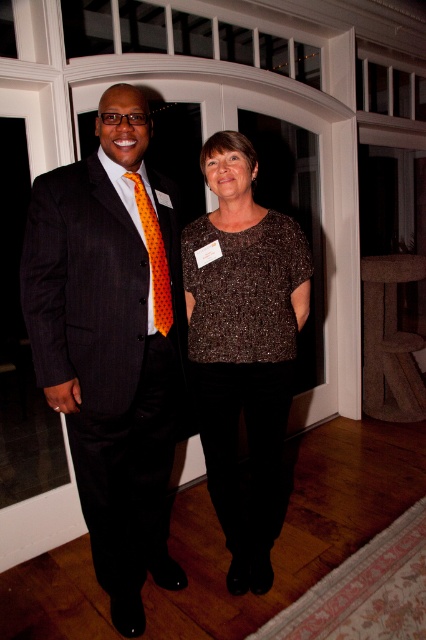
Measure the distance from matte black suit at left to orange dotted tie at left.

A distance of 27.85 centimeters exists between matte black suit at left and orange dotted tie at left.

Is matte black suit at left shorter than orange dotted tie at left?

No, matte black suit at left is not shorter than orange dotted tie at left.

Find the location of a particular element. Image resolution: width=426 pixels, height=640 pixels. matte black suit at left is located at coordinates (112, 342).

How far apart are sparkly brown blouse at center and orange dotted tie at left?

sparkly brown blouse at center is 14.09 inches away from orange dotted tie at left.

Can you confirm if sparkly brown blouse at center is positioned to the right of orange dotted tie at left?

Correct, you'll find sparkly brown blouse at center to the right of orange dotted tie at left.

Between point (282, 509) and point (155, 301), which one is positioned behind?

Point (282, 509)

The width and height of the screenshot is (426, 640). Find the location of `sparkly brown blouse at center`. sparkly brown blouse at center is located at coordinates (244, 346).

Based on the photo, who is lower down, matte black suit at left or sparkly brown blouse at center?

sparkly brown blouse at center is lower down.

Does point (77, 486) lie in front of point (215, 284)?

That is True.

This screenshot has width=426, height=640. In order to click on matte black suit at left in this screenshot , I will do `click(112, 342)`.